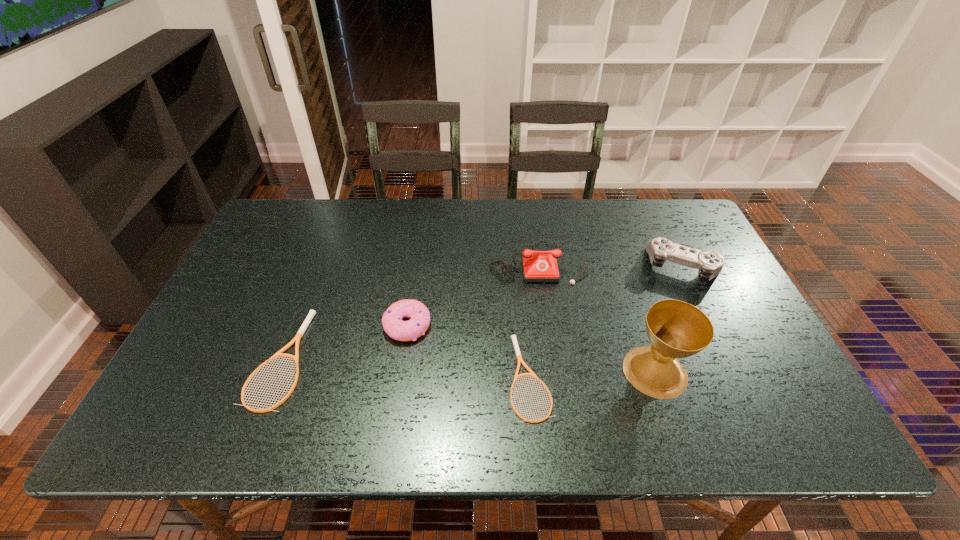
Where is `object situated at the near left corner`? Image resolution: width=960 pixels, height=540 pixels. object situated at the near left corner is located at coordinates (311, 314).

The height and width of the screenshot is (540, 960). What are the coordinates of `free space at the far edge of the desktop` in the screenshot? It's located at (630, 241).

Find the location of `vacant space at the near edge of the desktop`. vacant space at the near edge of the desktop is located at coordinates (515, 368).

In the image, there is a desktop. In order to click on blank space at the left edge in this screenshot , I will do `click(241, 300)`.

Where is `blank space at the right edge`? blank space at the right edge is located at coordinates (718, 362).

Identify the location of vacant space at the near left corner of the desktop. (179, 369).

In the image, there is a desktop. What are the coordinates of `free region at the far right corner` in the screenshot? It's located at (676, 209).

In the image, there is a desktop. Find the location of `vacant space at the near right corner`. vacant space at the near right corner is located at coordinates (720, 377).

In order to click on empty space that is in between the shortest object and the telephone in this screenshot , I will do `click(534, 320)`.

The image size is (960, 540). I want to click on blank region between the telephone and the second object from left to right, so click(x=472, y=294).